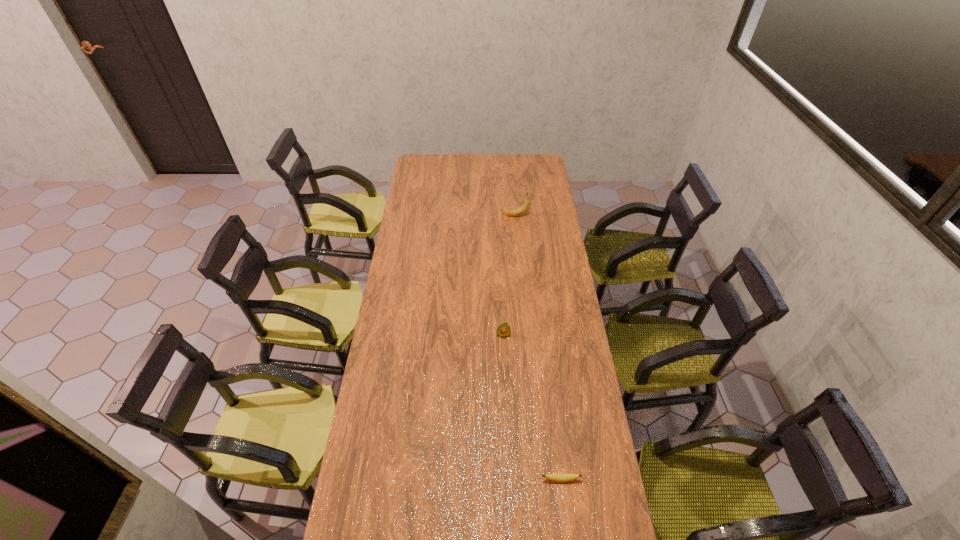
Where is `the farthest object`? Image resolution: width=960 pixels, height=540 pixels. the farthest object is located at coordinates (523, 209).

The width and height of the screenshot is (960, 540). I want to click on the farther banana, so click(523, 209).

Where is `avocado`? avocado is located at coordinates (503, 330).

The width and height of the screenshot is (960, 540). In order to click on the second farthest object in this screenshot , I will do `click(503, 330)`.

Find the location of a particular element. Image resolution: width=960 pixels, height=540 pixels. the shorter banana is located at coordinates click(557, 477).

What are the coordinates of `the nearer banana` in the screenshot? It's located at (557, 477).

Locate an element on the screen. The height and width of the screenshot is (540, 960). free region located 0.140m at the start of the peel on the tallest object is located at coordinates (476, 216).

Where is `vacant region located 0.170m at the start of the peel on the tallest object`? vacant region located 0.170m at the start of the peel on the tallest object is located at coordinates (470, 216).

Where is `vacant point located 0.130m at the start of the peel on the tallest object`? vacant point located 0.130m at the start of the peel on the tallest object is located at coordinates (478, 216).

Locate an element on the screen. vacant space located on the cut side of the avocado is located at coordinates (504, 356).